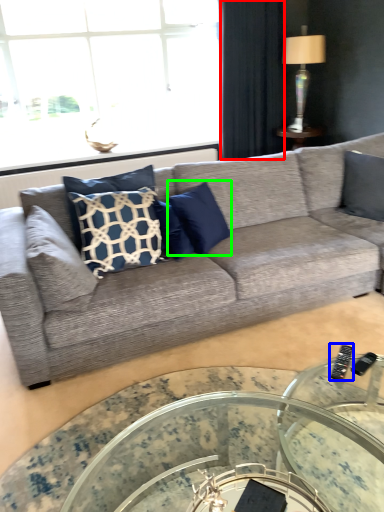
Question: Considering the real-world distances, which object is closest to curtain (highlighted by a red box)? remote (highlighted by a blue box) or pillow (highlighted by a green box).

Choices:
 (A) remote
 (B) pillow

Answer: (B)